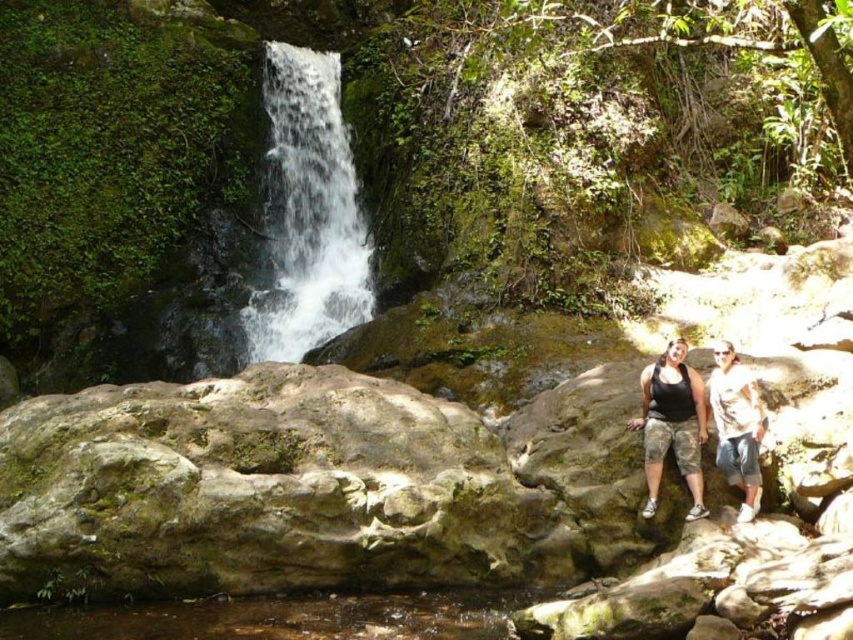
You are a hiker who wants to cross the stream shown in the image. The white frothy water at center is flowing rapidly, and the brown sedimentary rock at lower center is a dry, stable surface. How far apart are these two landmarks?

The white frothy water at center and the brown sedimentary rock at lower center are 15.23 meters apart from each other.

You are a photographer trying to capture the white frothy water at center and the camouflage pants at lower right in the same frame. Based on their positions, which object is closer to the left side of your camera view?

The white frothy water at center is to the left of camouflage pants at lower right, so the white frothy water at center is closer to the left side of the camera view.

You are standing on the mossy rock in the foreground of the scene. You want to take a photo of the white frothy water at center. Where should you point your camera to capture it?

You should point your camera towards the center of the scene at coordinates approximately 0.333 on the x and 0.362 on the y axis to capture the white frothy water at center.